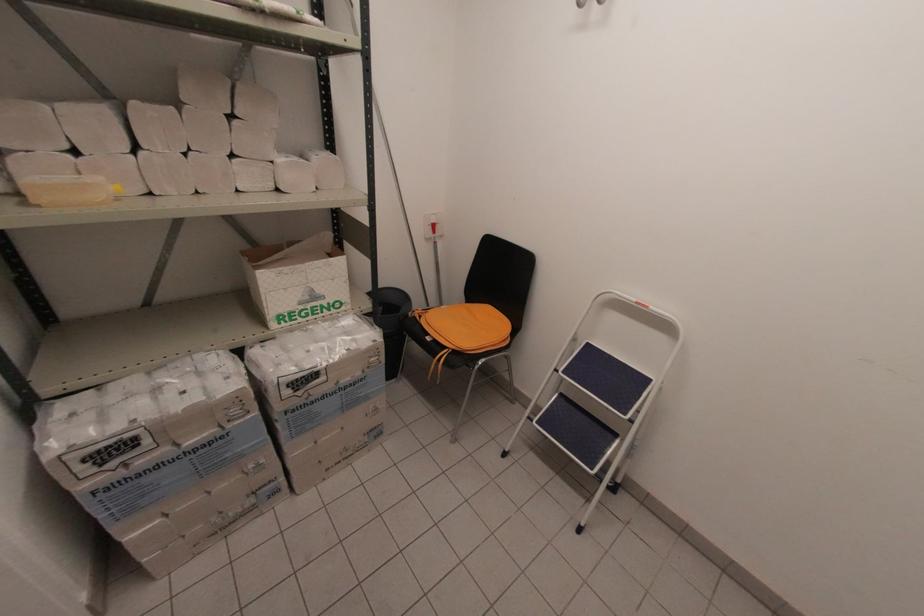
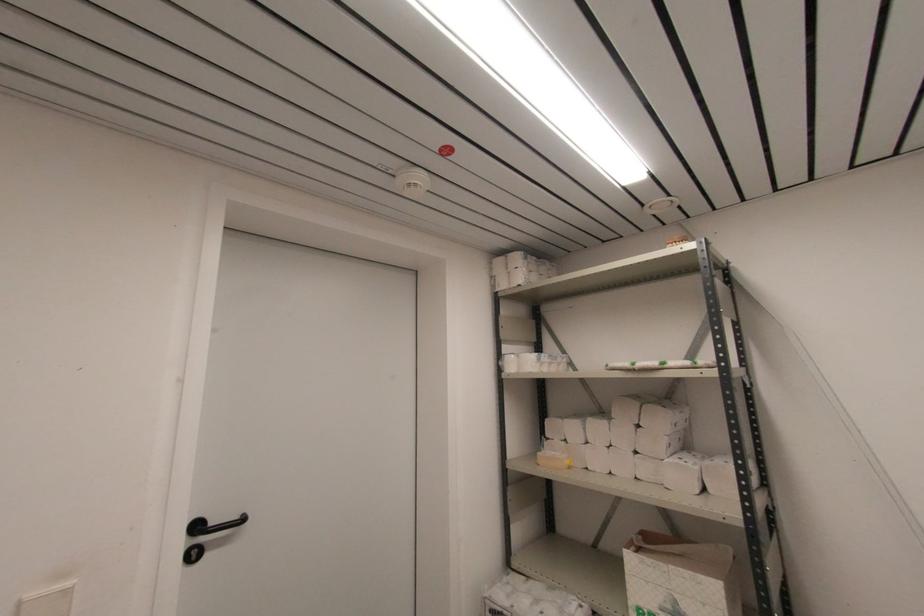
In the second image, find the point that corresponds to point (309, 298) in the first image.

(671, 609)